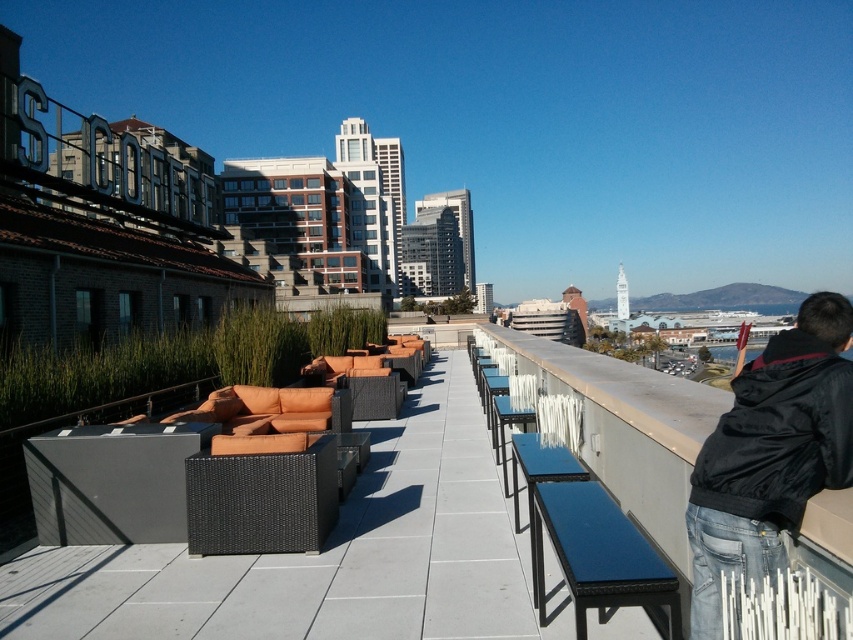
You are a visitor on the rooftop terrace and want to place your black matte jacket at upper right on the blue plastic bench at right. Can you reach the bench without moving the jacket?

The black matte jacket at upper right is further to the viewer than the blue plastic bench at right, so you can reach the bench by moving forward from the jacket.

You are a delivery person who needs to place a package on the rooftop terrace. The package must be placed exactly at the coordinates specified by the client, which is point A at position 0.709 on the x and 0.904 on the y. You see the black matte jacket at upper right. Can you confirm if the jacket is at point A?

The black matte jacket at upper right is located at point (x=770, y=452), so yes, the jacket is at point A. The package should be placed there.

You are a photographer standing at the edge of the rooftop terrace near the white railing. You want to take a photo of the black matte jacket at upper right without moving any objects. Can you capture it in your current position?

The black matte jacket at upper right is 8.09 feet away from camera, so yes, you can capture it in your current position as the distance is within a typical camera lens range.